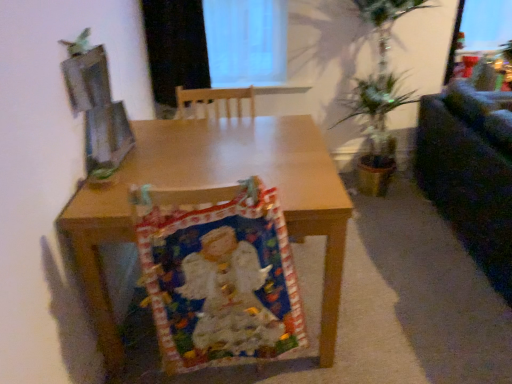
Question: From the image's perspective, does black matte curtain at upper center appear higher than wooden desk at center?

Choices:
 (A) yes
 (B) no

Answer: (A)

Question: From a real-world perspective, does black matte curtain at upper center sit lower than wooden desk at center?

Choices:
 (A) yes
 (B) no

Answer: (B)

Question: Does black matte curtain at upper center contain wooden desk at center?

Choices:
 (A) no
 (B) yes

Answer: (A)

Question: Considering the relative sizes of black matte curtain at upper center and wooden desk at center in the image provided, is black matte curtain at upper center shorter than wooden desk at center?

Choices:
 (A) yes
 (B) no

Answer: (A)

Question: Is black matte curtain at upper center placed right next to wooden desk at center?

Choices:
 (A) no
 (B) yes

Answer: (A)

Question: Does black matte curtain at upper center have a greater width compared to wooden desk at center?

Choices:
 (A) no
 (B) yes

Answer: (A)

Question: Could you tell me if dark fabric couch at right is turned towards wooden desk at center?

Choices:
 (A) no
 (B) yes

Answer: (A)

Question: From a real-world perspective, is dark fabric couch at right over wooden desk at center?

Choices:
 (A) no
 (B) yes

Answer: (B)

Question: Is dark fabric couch at right to the left of wooden desk at center from the viewer's perspective?

Choices:
 (A) no
 (B) yes

Answer: (A)

Question: From a real-world perspective, is dark fabric couch at right physically below wooden desk at center?

Choices:
 (A) yes
 (B) no

Answer: (B)

Question: Can you confirm if dark fabric couch at right is positioned to the right of wooden desk at center?

Choices:
 (A) no
 (B) yes

Answer: (B)

Question: Considering the relative sizes of dark fabric couch at right and wooden desk at center in the image provided, is dark fabric couch at right wider than wooden desk at center?

Choices:
 (A) yes
 (B) no

Answer: (B)

Question: Is multicolored fabric at center located outside black matte curtain at upper center?

Choices:
 (A) no
 (B) yes

Answer: (B)